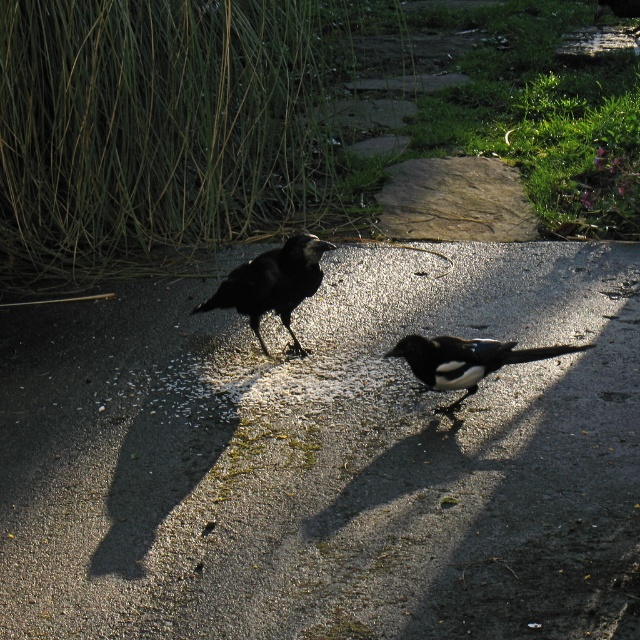
Question: Among these points, which one is farthest from the camera?

Choices:
 (A) (422, 346)
 (B) (563, 323)
 (C) (250, 285)

Answer: (B)

Question: Is glossy asphalt at center to the left of white glossy magpie at center from the viewer's perspective?

Choices:
 (A) yes
 (B) no

Answer: (A)

Question: Which point is closer to the camera?

Choices:
 (A) shiny black crow at center
 (B) white glossy magpie at center

Answer: (B)

Question: Does glossy asphalt at center appear on the left side of white glossy magpie at center?

Choices:
 (A) no
 (B) yes

Answer: (B)

Question: In this image, where is glossy asphalt at center located relative to white glossy magpie at center?

Choices:
 (A) below
 (B) above

Answer: (B)

Question: Which point is closer to the camera?

Choices:
 (A) white glossy magpie at center
 (B) shiny black crow at center
 (C) glossy asphalt at center

Answer: (C)